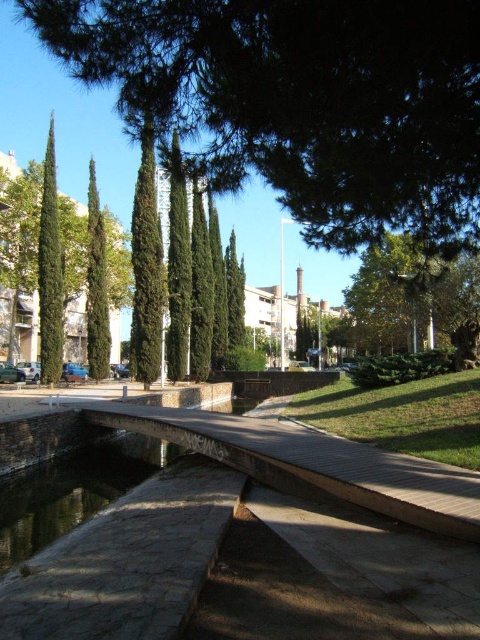
I want to click on smooth stone water at lower left, so click(x=72, y=490).

Measure the distance between smooth stone water at lower left and camera.

smooth stone water at lower left is 6.76 meters from camera.

Which is in front, point (110, 499) or point (58, 289)?

Point (110, 499)

You are a GUI agent. You are given a task and a screenshot of the screen. Output one action in this format:
    pyautogui.click(x=<x>, y=<y>)
    Task: Click on the smooth stone water at lower left
    
    Given the screenshot: What is the action you would take?
    pyautogui.click(x=72, y=490)

Can you confirm if green needle-like at center is bigger than green textured tree at center?

Actually, green needle-like at center might be smaller than green textured tree at center.

Is green needle-like at center closer to camera compared to green textured tree at center?

That is True.

The height and width of the screenshot is (640, 480). Describe the element at coordinates (302, 100) in the screenshot. I see `green needle-like at center` at that location.

At what (x,y) coordinates should I click in order to perform the action: click on green needle-like at center. Please return your answer as a coordinate pair (x, y). Looking at the image, I should click on (302, 100).

Consider the image. How much distance is there between green needle-like at center and smooth stone water at lower left?

green needle-like at center and smooth stone water at lower left are 32.78 feet apart.

You are a GUI agent. You are given a task and a screenshot of the screen. Output one action in this format:
    pyautogui.click(x=<x>, y=<y>)
    Task: Click on the green needle-like at center
    This screenshot has width=480, height=640.
    Given the screenshot: What is the action you would take?
    (302, 100)